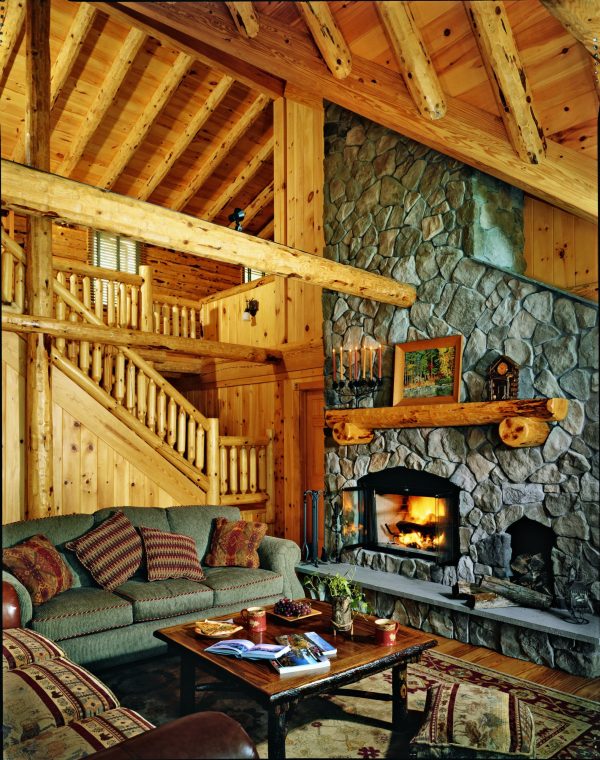
The height and width of the screenshot is (760, 600). I want to click on dark brown hardwood floor, so click(518, 665), click(464, 648), click(565, 682).